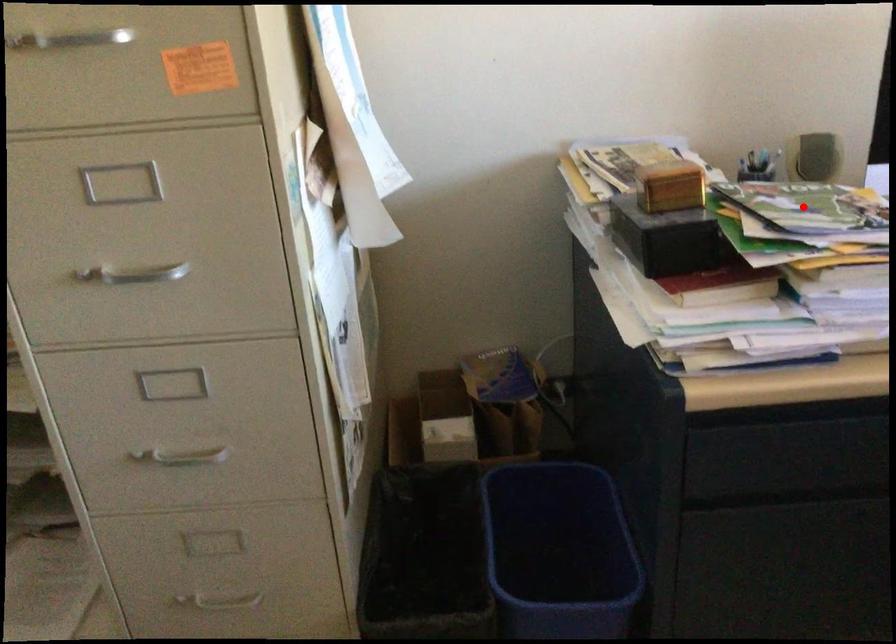
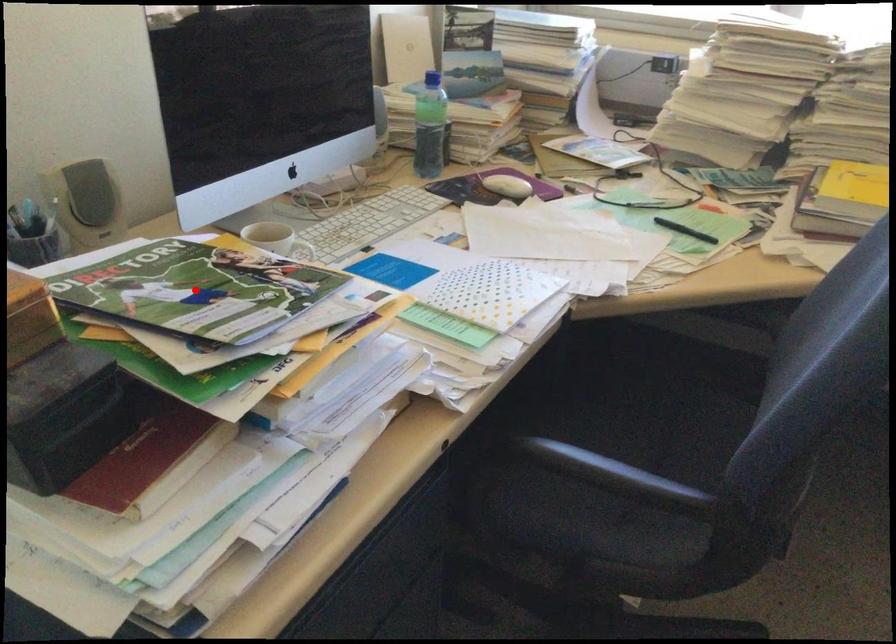
I am providing you with two images of the same scene from different viewpoints. A red point is marked on the first image and another point is marked on the second image. Do the highlighted points in image1 and image2 indicate the same real-world spot?

Yes